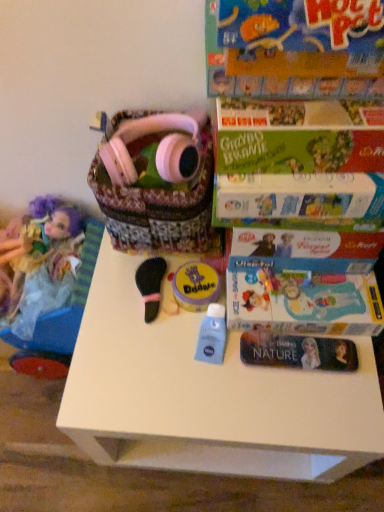
The width and height of the screenshot is (384, 512). I want to click on free space in front of blue matte lotion at center, so click(215, 408).